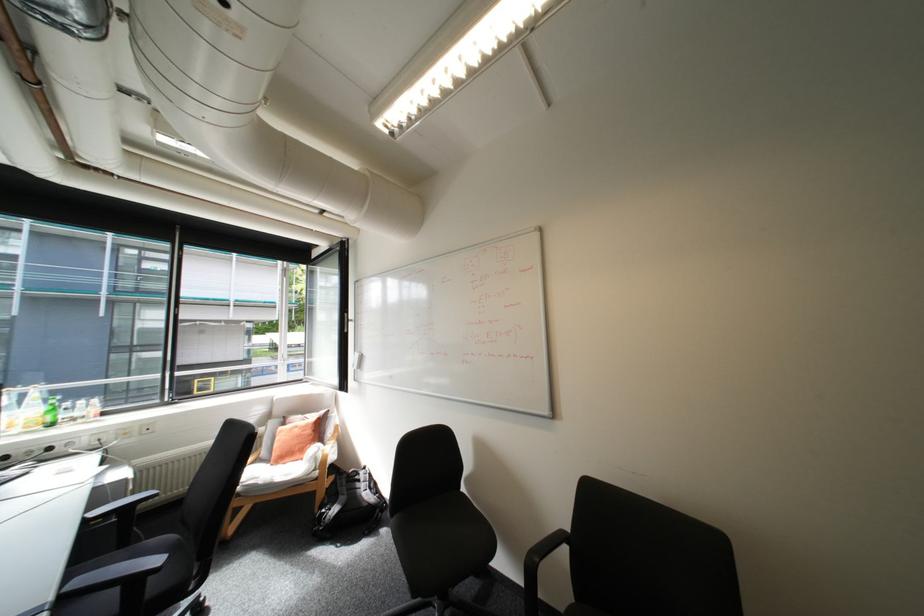
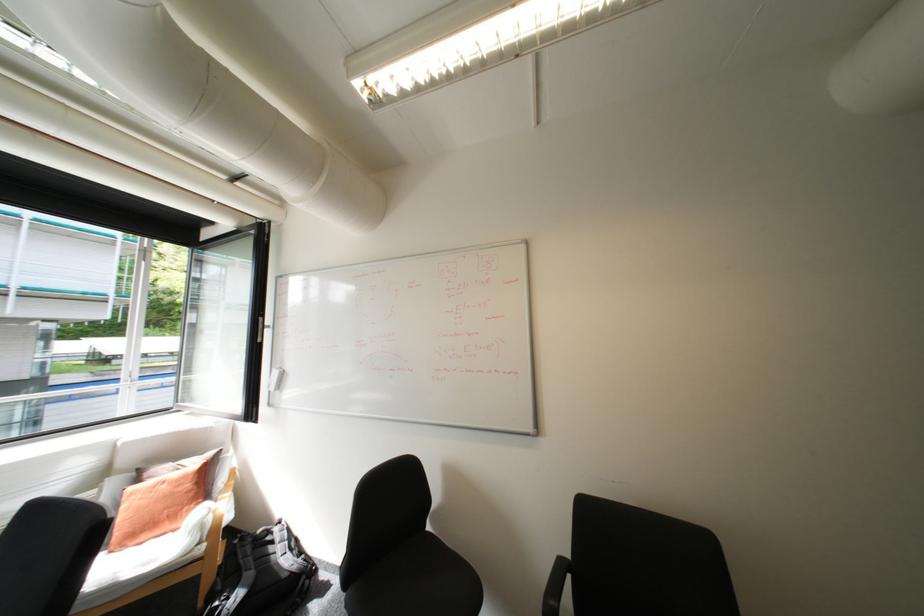
Where in the second image is the point corresponding to (282,464) from the first image?

(122, 552)